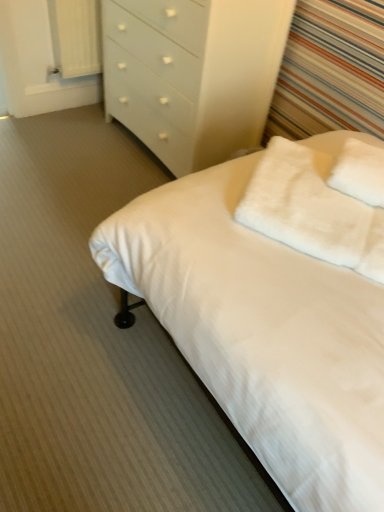
Where is `vacant space in white fabric curtain at upper left (from a real-world perspective)`? vacant space in white fabric curtain at upper left (from a real-world perspective) is located at coordinates (84, 106).